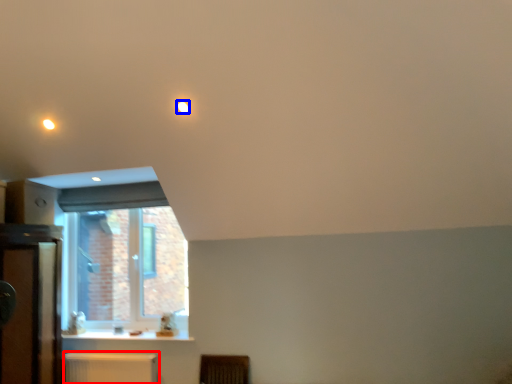
Question: Which object is closer to the camera taking this photo, radiator (highlighted by a red box) or lighting (highlighted by a blue box)?

Choices:
 (A) radiator
 (B) lighting

Answer: (B)